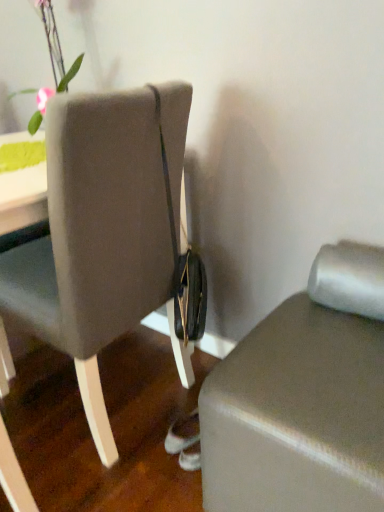
Question: Looking at the image, does matte gray ottoman at lower right seem bigger or smaller compared to green matte vase at upper left?

Choices:
 (A) small
 (B) big

Answer: (B)

Question: Visually, is matte gray ottoman at lower right positioned to the left or to the right of green matte vase at upper left?

Choices:
 (A) left
 (B) right

Answer: (B)

Question: Based on their relative distances, which object is farther from the green matte vase at upper left?

Choices:
 (A) matte gray ottoman at lower right
 (B) matte gray chair at center

Answer: (A)

Question: Which object is positioned farthest from the green matte vase at upper left?

Choices:
 (A) matte gray chair at center
 (B) matte gray ottoman at lower right

Answer: (B)